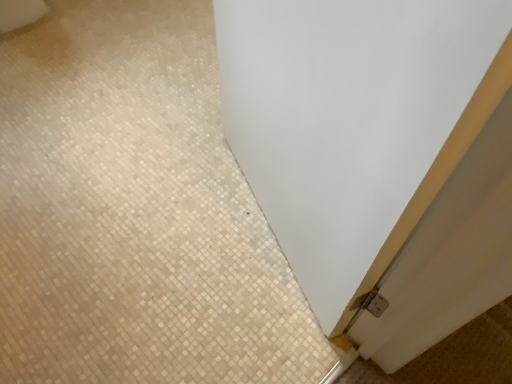
Identify the location of white matte door at center. The width and height of the screenshot is (512, 384). (377, 154).

What do you see at coordinates (377, 154) in the screenshot?
I see `white matte door at center` at bounding box center [377, 154].

Where is `white matte door at center`? This screenshot has height=384, width=512. white matte door at center is located at coordinates (377, 154).